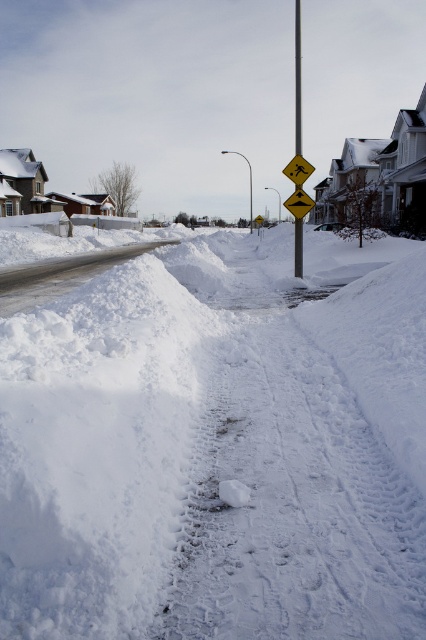
Can you confirm if metallic pole at center is positioned below yellow reflective diamond at center?

No, metallic pole at center is not below yellow reflective diamond at center.

The width and height of the screenshot is (426, 640). I want to click on metallic pole at center, so click(x=298, y=80).

The image size is (426, 640). I want to click on metallic pole at center, so click(x=298, y=80).

Which is more to the right, white fluffy snow at center or metallic pole at center?

metallic pole at center

Identify the location of white fluffy snow at center. (218, 445).

Is the position of white fluffy snow at center less distant than that of yellow reflective diamond at center?

Yes, it is.

Is point (109, 368) closer to viewer compared to point (293, 173)?

Yes, point (109, 368) is in front of point (293, 173).

Locate an element on the screen. white fluffy snow at center is located at coordinates (218, 445).